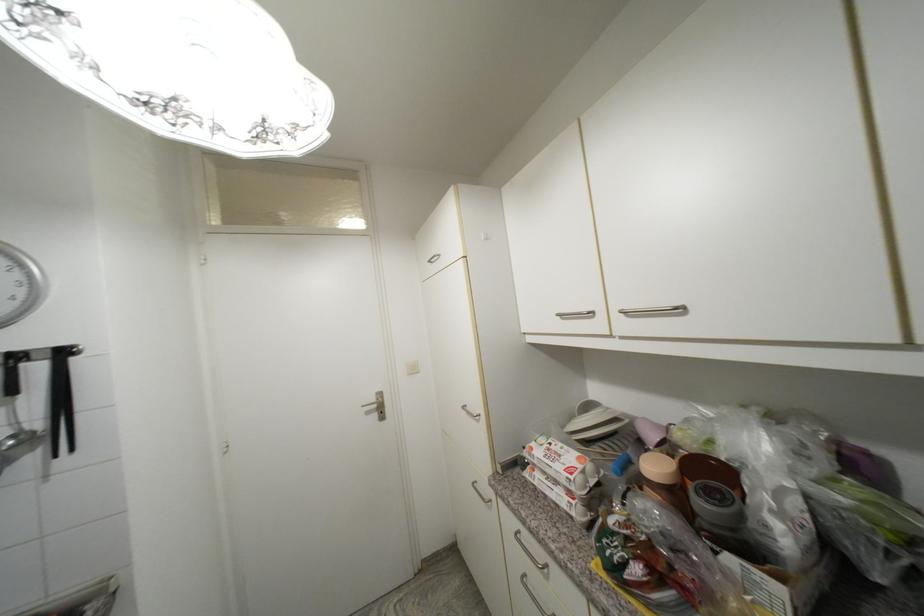
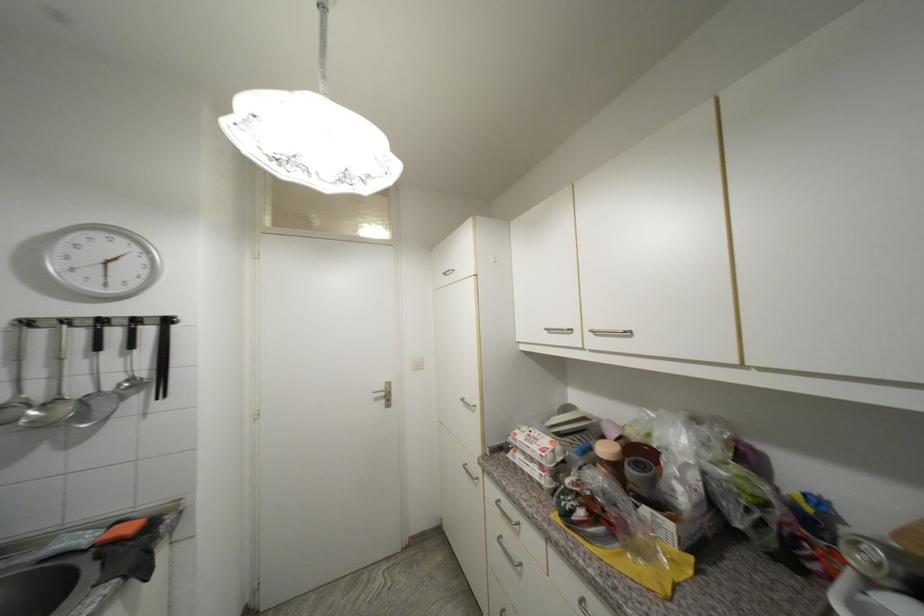
The point at (631, 309) is marked in the first image. Where is the corresponding point in the second image?

(601, 330)